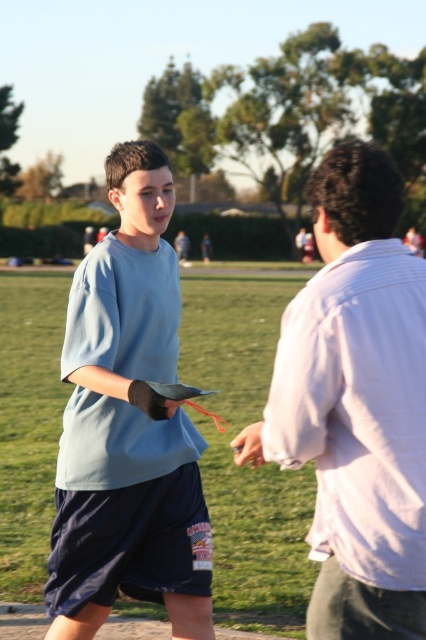
Question: Which point is closer to the camera taking this photo?

Choices:
 (A) (69, 541)
 (B) (394, 360)
 (C) (256, 445)

Answer: (B)

Question: Which of the following is the farthest from the observer?

Choices:
 (A) (273, 404)
 (B) (78, 577)

Answer: (B)

Question: In this image, where is white striped shirt at right located relative to light blue t-shirt at center?

Choices:
 (A) below
 (B) above

Answer: (B)

Question: Does white striped shirt at right appear on the left side of navy blue shorts at lower left?

Choices:
 (A) yes
 (B) no

Answer: (B)

Question: Can you confirm if navy blue shorts at lower left is positioned to the left of matte black glove at center?

Choices:
 (A) no
 (B) yes

Answer: (B)

Question: Which is farther from the light blue t-shirt at center?

Choices:
 (A) white striped shirt at right
 (B) navy blue shorts at lower left

Answer: (A)